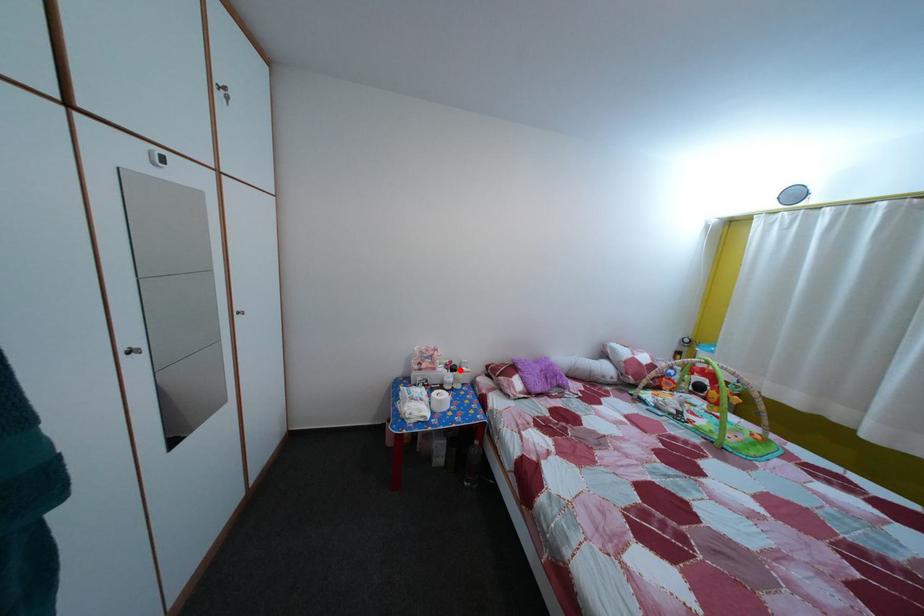
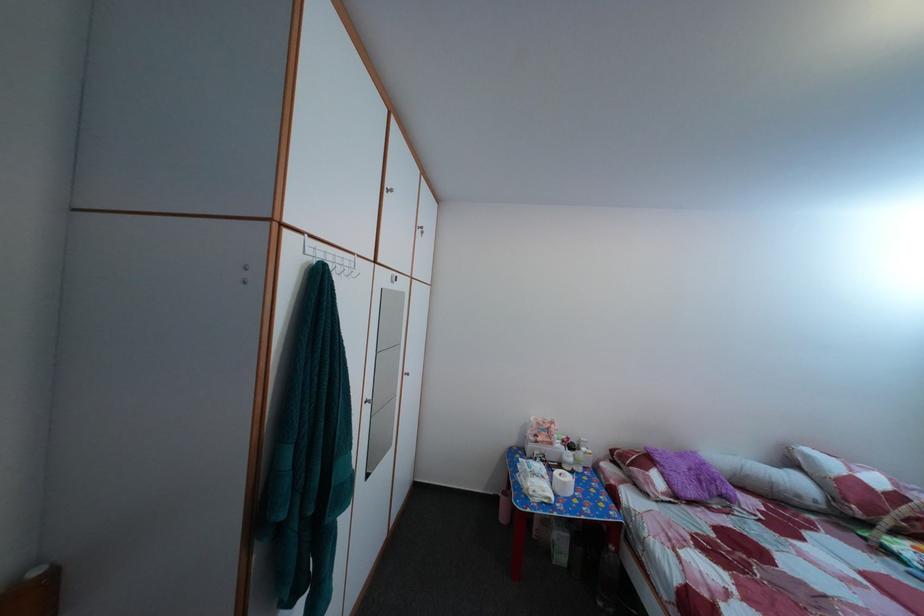
Question: I am providing you with two images of the same scene from different viewpoints. Given a red point in image1, look at the same physical point in image2. Is it:

Choices:
 (A) Closer to the viewpoint
 (B) Farther from the viewpoint

Answer: (B)